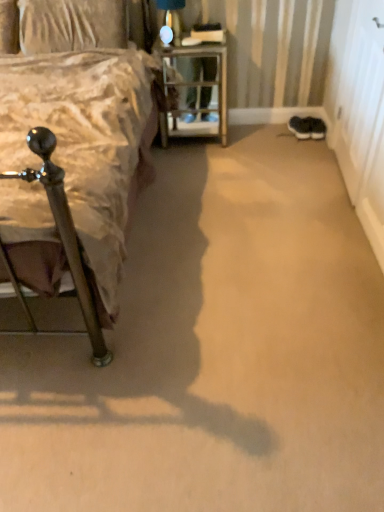
Question: Considering the positions of textured beige pillow at upper left and black suede sneakers at lower right, which is the 2th footwear from left to right, in the image, is textured beige pillow at upper left bigger or smaller than black suede sneakers at lower right, which is the 2th footwear from left to right,?

Choices:
 (A) big
 (B) small

Answer: (A)

Question: Looking at their shapes, would you say textured beige pillow at upper left is wider or thinner than black suede sneakers at lower right, marked as the first footwear in a right-to-left arrangement?

Choices:
 (A) wide
 (B) thin

Answer: (B)

Question: Which of these objects is positioned farthest from the black suede sneakers at lower right, which is the 2th footwear from left to right?

Choices:
 (A) metallic silver bed at left
 (B) metal/textured nightstand at center
 (C) black suede sneakers at lower right, which is the second footwear in right-to-left order
 (D) textured beige pillow at upper left
 (E) white wood screen door at right

Answer: (A)

Question: Estimate the real-world distances between objects in this image. Which object is farther from the textured beige pillow at upper left?

Choices:
 (A) black suede sneakers at lower right, marked as the first footwear in a right-to-left arrangement
 (B) metallic silver bed at left
 (C) metal/textured nightstand at center
 (D) white wood screen door at right
 (E) black suede sneakers at lower right, which is the second footwear in right-to-left order

Answer: (A)